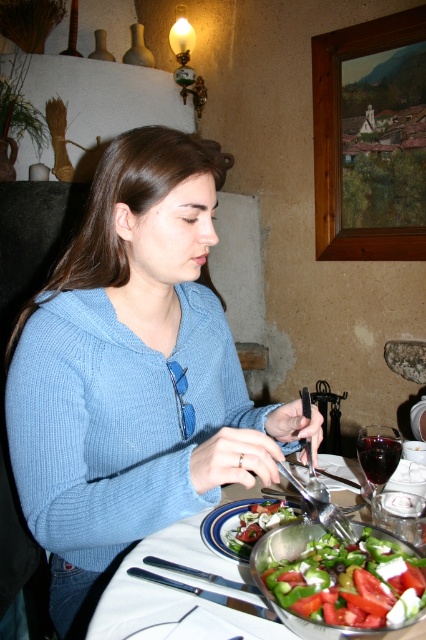
Between blue knitted sweater at center and wooden picture frame at upper right, which one has less height?

blue knitted sweater at center

Measure the distance between point (230,396) and camera.

Point (230,396) and camera are 3.53 feet apart.

Locate an element on the screen. The height and width of the screenshot is (640, 426). blue knitted sweater at center is located at coordinates (134, 371).

Can you confirm if wooden picture frame at upper right is bigger than green leafy salad at center?

Indeed, wooden picture frame at upper right has a larger size compared to green leafy salad at center.

Find the location of a particular element. The width and height of the screenshot is (426, 640). wooden picture frame at upper right is located at coordinates (340, 140).

The image size is (426, 640). I want to click on wooden picture frame at upper right, so click(x=340, y=140).

You are a GUI agent. You are given a task and a screenshot of the screen. Output one action in this format:
    pyautogui.click(x=<x>, y=<y>)
    Task: Click on the wooden picture frame at upper right
    This screenshot has width=426, height=640.
    Given the screenshot: What is the action you would take?
    pyautogui.click(x=340, y=140)

Does glassy plastic salad bowl at center have a larger size compared to green leafy salad at center?

A: Yes, glassy plastic salad bowl at center is bigger than green leafy salad at center.

Consider the image. Does glassy plastic salad bowl at center have a greater height compared to green leafy salad at center?

Yes, glassy plastic salad bowl at center is taller than green leafy salad at center.

Does point (126, 595) lie in front of point (255, 532)?

Yes, point (126, 595) is in front of point (255, 532).

The height and width of the screenshot is (640, 426). Identify the location of glassy plastic salad bowl at center. (161, 586).